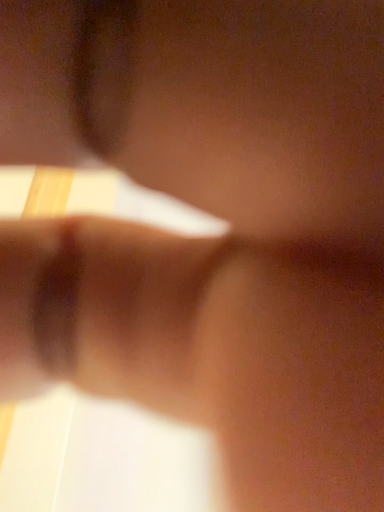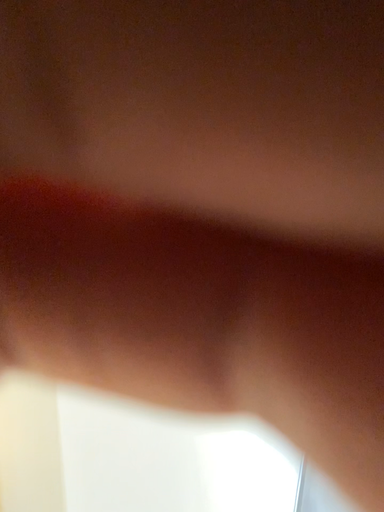
Question: Which way did the camera rotate in the video?

Choices:
 (A) rotated downward
 (B) rotated upward

Answer: (A)